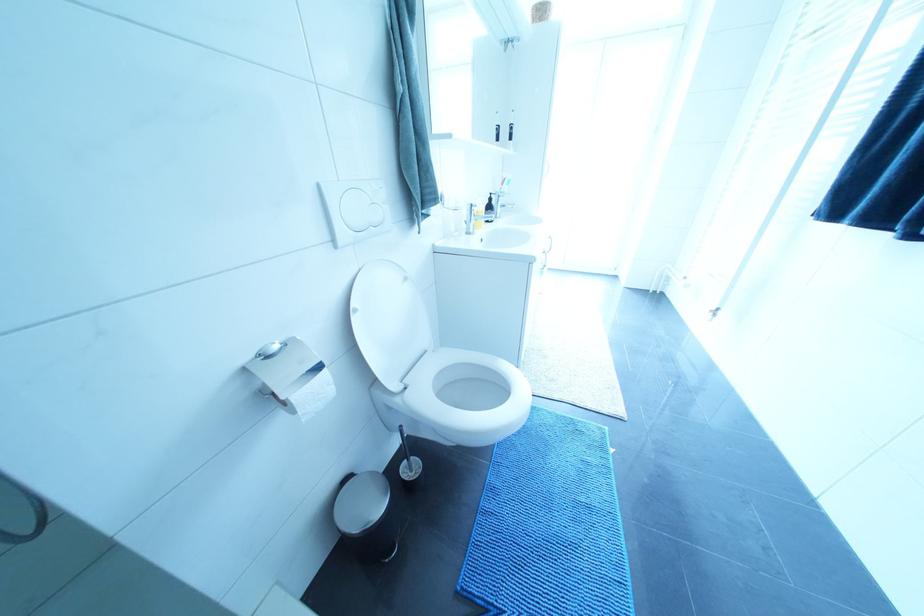
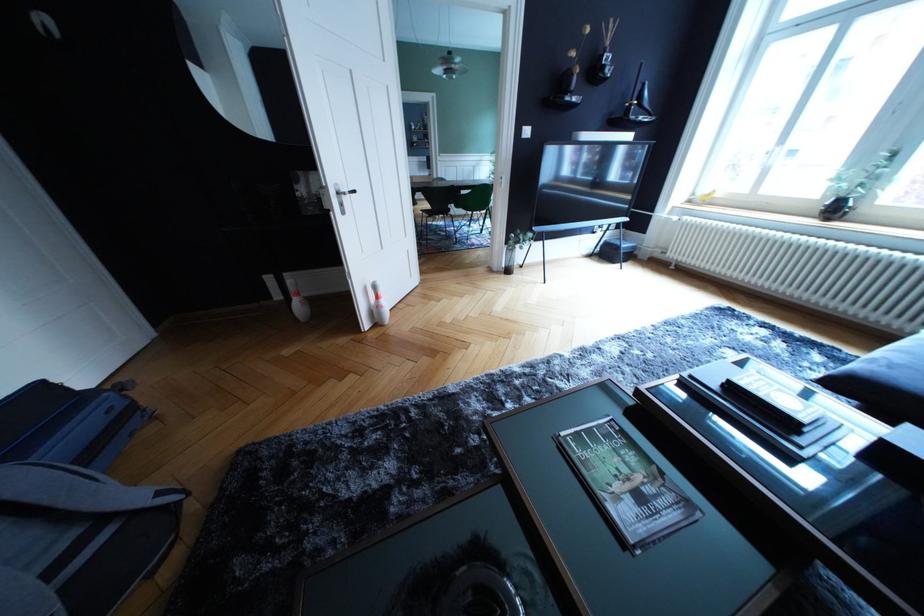
Question: I am providing you with two images of the same scene from different viewpoints. Please identify which objects are invisible in image2.

Choices:
 (A) black wall vase
 (B) black board eraser
 (C) white toilet lid
 (D) Elle magazine

Answer: (C)